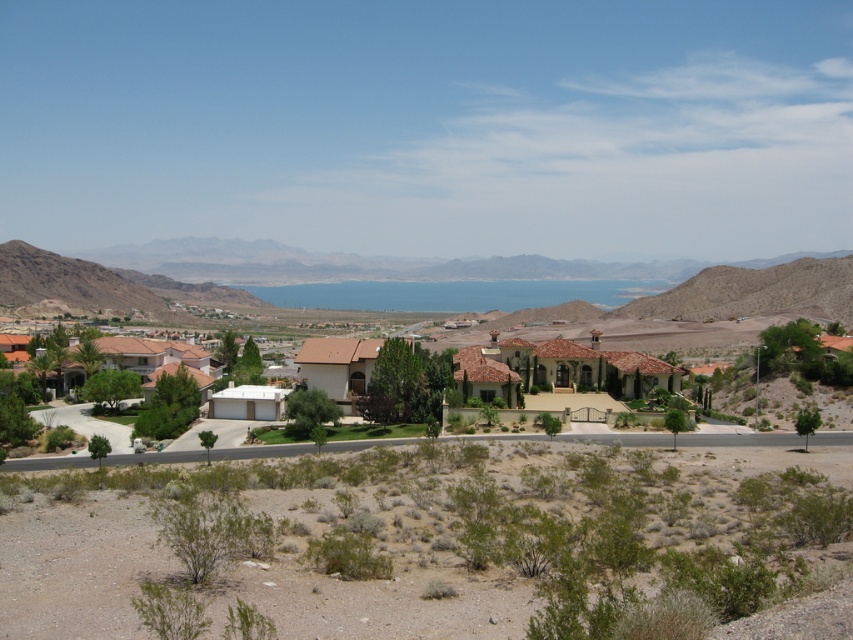
Does green shrubbery at lower center appear on the right side of brown tile roof houses at center?

No, green shrubbery at lower center is not to the right of brown tile roof houses at center.

Does point (33, 509) come farther from viewer compared to point (699, 333)?

No, it is in front of (699, 333).

Is point (651, 552) less distant than point (624, 320)?

Yes, it is.

You are a GUI agent. You are given a task and a screenshot of the screen. Output one action in this format:
    pyautogui.click(x=<x>, y=<y>)
    Task: Click on the green shrubbery at lower center
    This screenshot has width=853, height=640.
    Given the screenshot: What is the action you would take?
    pyautogui.click(x=436, y=538)

Can you confirm if desert sand at left is wider than brown tile roof houses at center?

Indeed, desert sand at left has a greater width compared to brown tile roof houses at center.

Does point (230, 291) come farther from viewer compared to point (460, 372)?

Yes.

Where is `desert sand at left`? desert sand at left is located at coordinates (99, 284).

What do you see at coordinates (436, 538) in the screenshot? Image resolution: width=853 pixels, height=640 pixels. I see `green shrubbery at lower center` at bounding box center [436, 538].

Does point (544, 484) lie in front of point (93, 282)?

Yes, point (544, 484) is in front of point (93, 282).

At what (x,y) coordinates should I click in order to perform the action: click on green shrubbery at lower center. Please return your answer as a coordinate pair (x, y). This screenshot has width=853, height=640. Looking at the image, I should click on (436, 538).